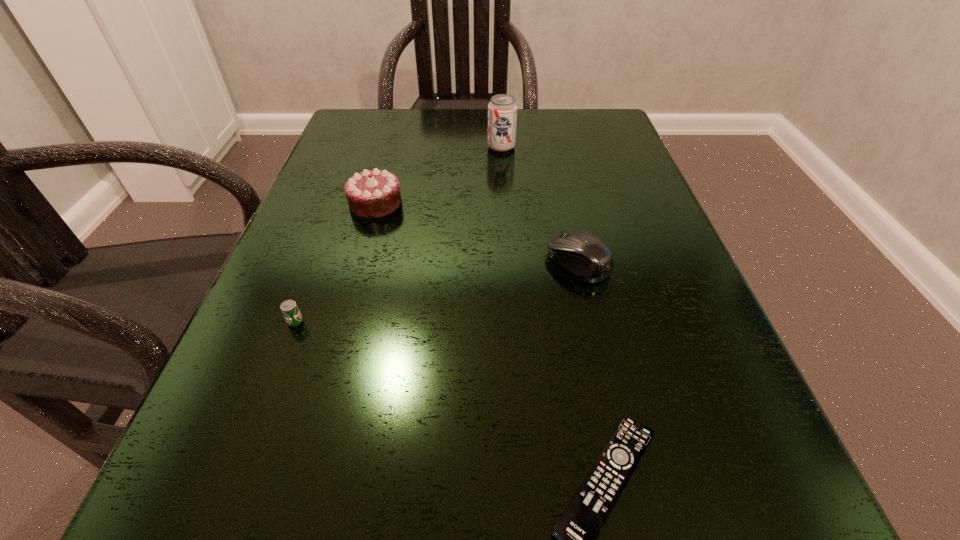
Where is `blank space located on the back of the third shortest object`? blank space located on the back of the third shortest object is located at coordinates (548, 133).

Locate an element on the screen. The height and width of the screenshot is (540, 960). vacant space positioned on the front of the shorter beer can is located at coordinates (247, 448).

The width and height of the screenshot is (960, 540). Identify the location of object at the far edge. (502, 110).

The image size is (960, 540). What are the coordinates of `chocolate cake situated at the left edge` in the screenshot? It's located at (375, 193).

The height and width of the screenshot is (540, 960). I want to click on beer can present at the left edge, so click(289, 308).

Identify the location of object that is at the right edge. This screenshot has height=540, width=960. (582, 254).

In the image, there is a desktop. In order to click on vacant space at the far edge in this screenshot , I will do `click(521, 137)`.

In the image, there is a desktop. Find the location of `free region at the near edge`. free region at the near edge is located at coordinates (489, 498).

Image resolution: width=960 pixels, height=540 pixels. In order to click on free point at the left edge in this screenshot , I will do `click(334, 261)`.

Find the location of a particular element. The width and height of the screenshot is (960, 540). vacant region at the right edge of the desktop is located at coordinates (646, 248).